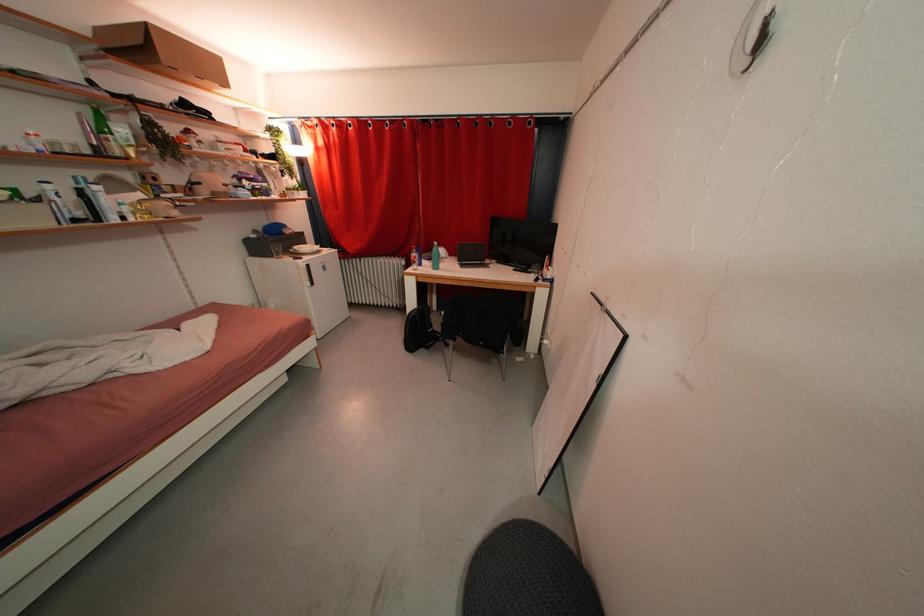
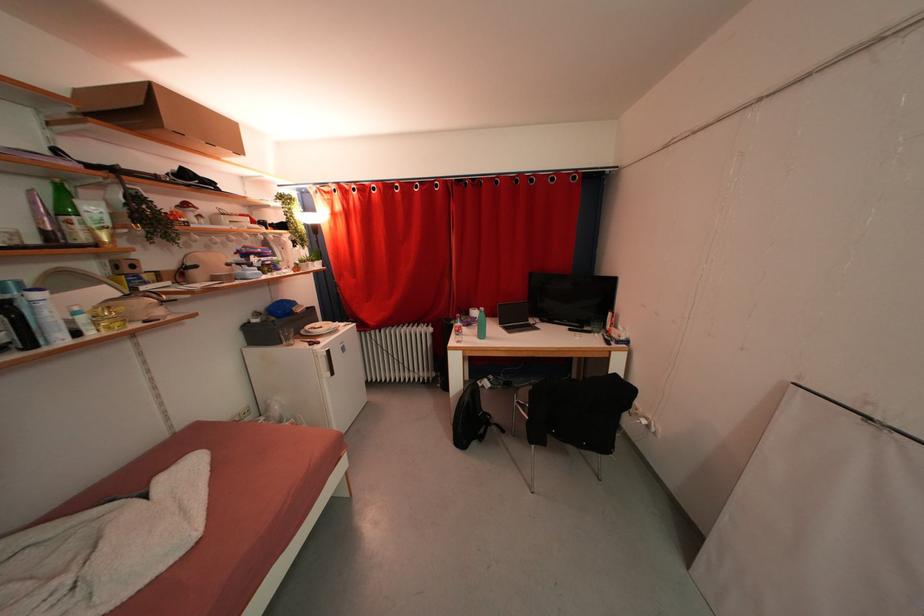
The point at (124, 156) is marked in the first image. Where is the corresponding point in the second image?

(89, 241)